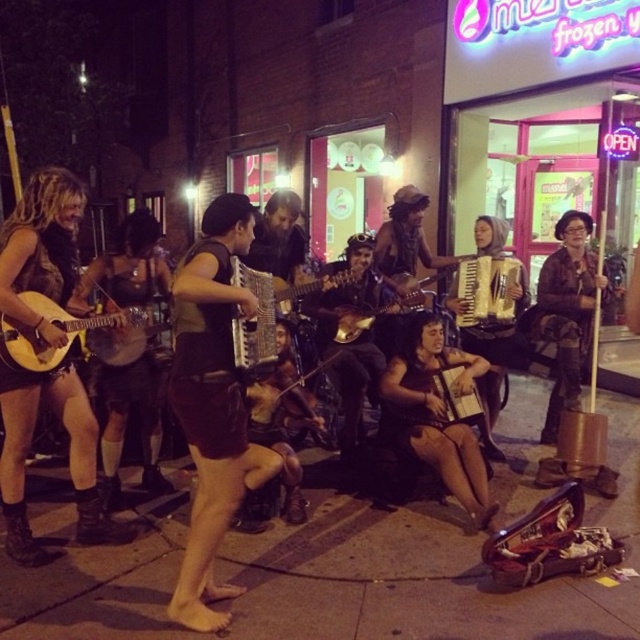
Is point (156, 568) behind point (426, 374)?

That is False.

What do you see at coordinates (400, 579) in the screenshot? The image size is (640, 640). I see `brown concrete pavement at center` at bounding box center [400, 579].

Is point (48, 637) farther from camera compared to point (406, 374)?

No, (48, 637) is in front of (406, 374).

I want to click on brown concrete pavement at center, so click(x=400, y=579).

Is wooden accordion at center smaller than light brown wooden accordion at center?

Incorrect, wooden accordion at center is not smaller in size than light brown wooden accordion at center.

Describe the element at coordinates (493, 358) in the screenshot. This screenshot has width=640, height=640. I see `wooden accordion at center` at that location.

Between point (474, 344) and point (516, 276), which one is positioned in front?

Point (516, 276) is in front.

Image resolution: width=640 pixels, height=640 pixels. I want to click on wooden accordion at center, so click(493, 358).

Which of these two, light brown wooden accordion at center or matte black accordion at center, stands taller?

With more height is light brown wooden accordion at center.

Is point (499, 284) positioned before point (244, 371)?

No.

Is point (456, 312) positioned before point (260, 371)?

No, (456, 312) is further to viewer.

At what (x,y) coordinates should I click in order to perform the action: click on light brown wooden accordion at center. Please return your answer as a coordinate pair (x, y). The height and width of the screenshot is (640, 640). Looking at the image, I should click on (486, 292).